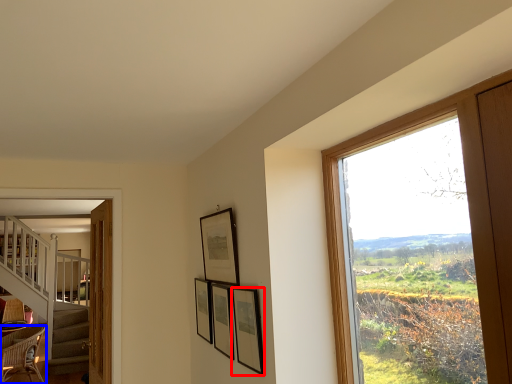
Question: Which of the following is the farthest to the observer, picture frame (highlighted by a red box) or chair (highlighted by a blue box)?

Choices:
 (A) picture frame
 (B) chair

Answer: (B)